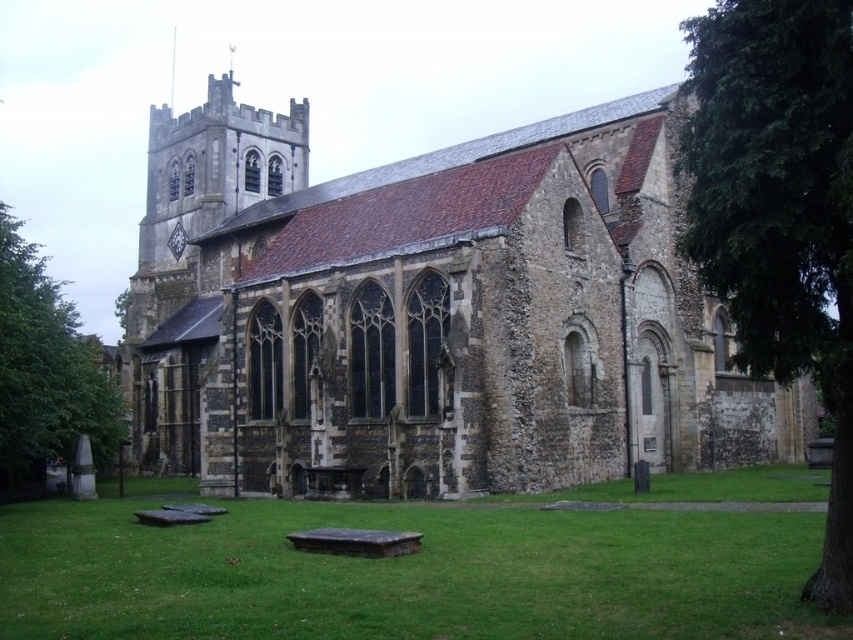
Question: Does brown stone church at center appear on the right side of green leafy tree at lower left?

Choices:
 (A) no
 (B) yes

Answer: (B)

Question: Which object is farther from the camera taking this photo?

Choices:
 (A) green grass at lower center
 (B) green leafy tree at lower left

Answer: (B)

Question: Which object appears farthest from the camera in this image?

Choices:
 (A) green grass at lower center
 (B) brown stone church at center

Answer: (B)

Question: Is green grass at lower center positioned in front of green leafy tree at right?

Choices:
 (A) no
 (B) yes

Answer: (B)

Question: Which is nearer to the green leafy tree at lower left?

Choices:
 (A) brown stone church at center
 (B) green leafy tree at right

Answer: (A)

Question: Can you confirm if green leafy tree at right is positioned to the left of green leafy tree at lower left?

Choices:
 (A) yes
 (B) no

Answer: (B)